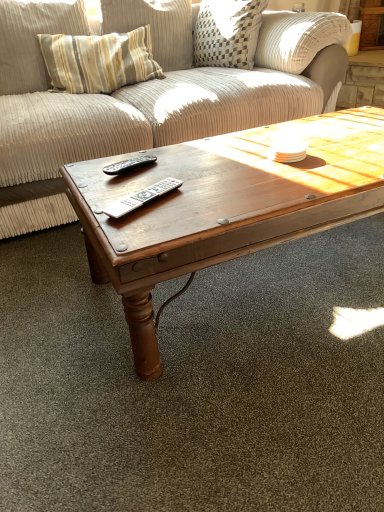
Question: From the image's perspective, is striped fabric pillow at upper left below silver metallic remote at center, which ranks as the 2th remote in back-to-front order?

Choices:
 (A) no
 (B) yes

Answer: (A)

Question: From a real-world perspective, is striped fabric pillow at upper left located higher than silver metallic remote at center, which ranks as the 2th remote in back-to-front order?

Choices:
 (A) yes
 (B) no

Answer: (A)

Question: Would you say striped fabric pillow at upper left is a long distance from silver metallic remote at center, the first remote positioned from the bottom?

Choices:
 (A) no
 (B) yes

Answer: (B)

Question: Is striped fabric pillow at upper left located outside silver metallic remote at center, placed as the first remote when sorted from front to back?

Choices:
 (A) yes
 (B) no

Answer: (A)

Question: Is striped fabric pillow at upper left next to silver metallic remote at center, marked as the second remote in a top-to-bottom arrangement, and touching it?

Choices:
 (A) no
 (B) yes

Answer: (A)

Question: Do you think striped fabric pillow at upper left is within wooden coffee table at center, or outside of it?

Choices:
 (A) inside
 (B) outside

Answer: (B)

Question: Is striped fabric pillow at upper left wider or thinner than wooden coffee table at center?

Choices:
 (A) wide
 (B) thin

Answer: (B)

Question: From the image's perspective, relative to wooden coffee table at center, is striped fabric pillow at upper left above or below?

Choices:
 (A) below
 (B) above

Answer: (B)

Question: In the image, is striped fabric pillow at upper left positioned in front of or behind wooden coffee table at center?

Choices:
 (A) front
 (B) behind

Answer: (B)

Question: In the image, is black plastic remote at center, the first remote from the back, positioned in front of or behind wooden coffee table at center?

Choices:
 (A) front
 (B) behind

Answer: (B)

Question: Is black plastic remote at center, which ranks as the 1th remote in top-to-bottom order, wider or thinner than wooden coffee table at center?

Choices:
 (A) thin
 (B) wide

Answer: (A)

Question: Considering the positions of point (137, 164) and point (362, 202), is point (137, 164) closer or farther from the camera than point (362, 202)?

Choices:
 (A) closer
 (B) farther

Answer: (B)

Question: Would you say black plastic remote at center, placed as the second remote when sorted from bottom to top, is to the left or to the right of wooden coffee table at center in the picture?

Choices:
 (A) right
 (B) left

Answer: (B)

Question: From the image's perspective, relative to striped fabric pillow at upper left, is black plastic remote at center, which is counted as the 2th remote, starting from the front, above or below?

Choices:
 (A) below
 (B) above

Answer: (A)

Question: Is black plastic remote at center, which ranks as the 1th remote in top-to-bottom order, spatially inside striped fabric pillow at upper left, or outside of it?

Choices:
 (A) outside
 (B) inside

Answer: (A)